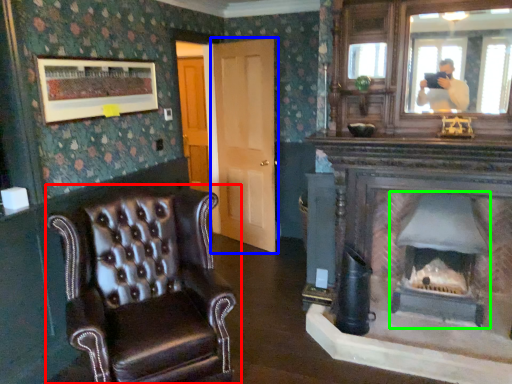
Question: Which object is the farthest from chair (highlighted by a red box)? Choose among these: door (highlighted by a blue box) or fireplace (highlighted by a green box).

Choices:
 (A) door
 (B) fireplace

Answer: (A)